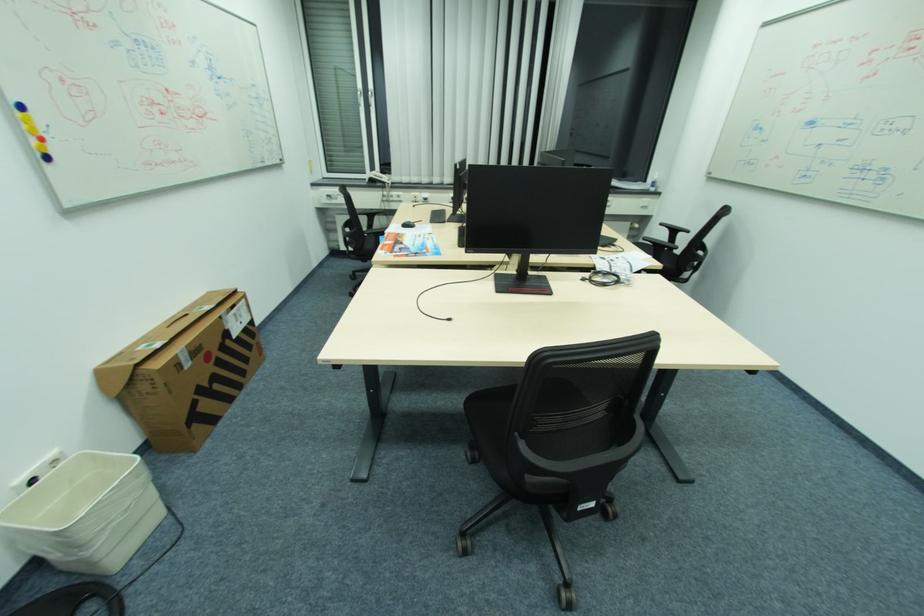
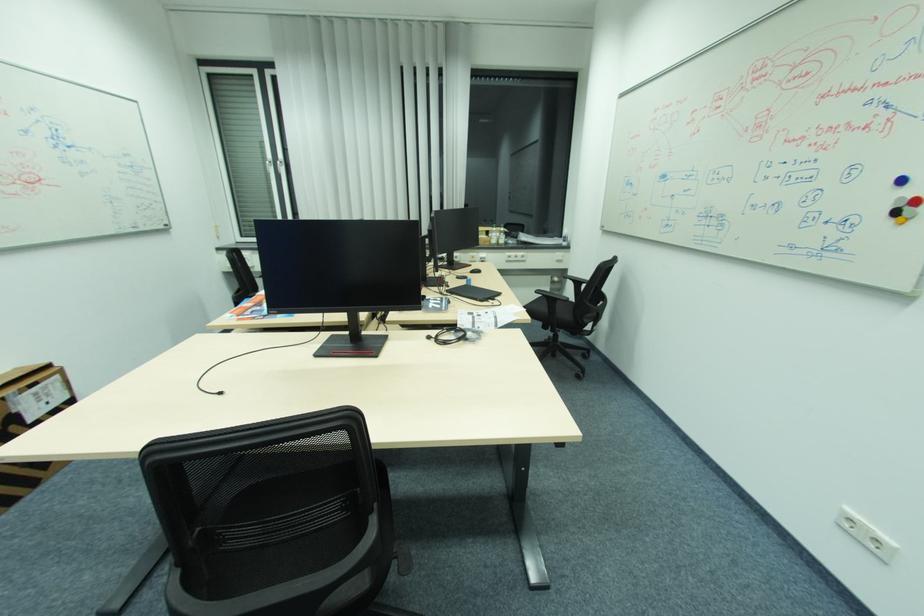
Find the pixel in the second image that matches point (606, 411) in the first image.

(339, 512)